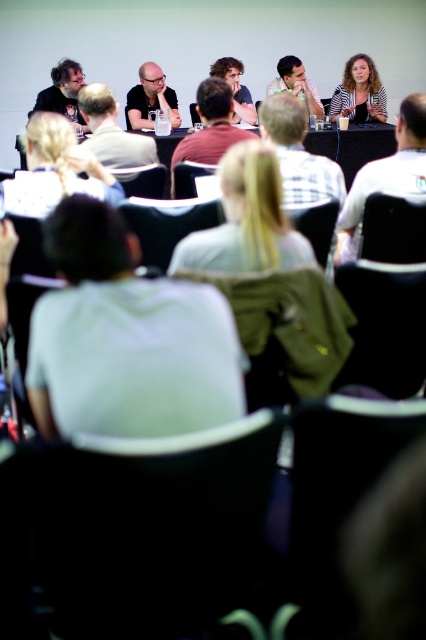
Is white checkered shirt at center taller than blonde hair at center?

No, white checkered shirt at center is not taller than blonde hair at center.

Who is positioned more to the right, white checkered shirt at center or blonde hair at center?

From the viewer's perspective, white checkered shirt at center appears more on the right side.

Which is behind, point (330, 172) or point (244, 112)?

Point (244, 112)

Find the location of a particular element. The height and width of the screenshot is (640, 426). white checkered shirt at center is located at coordinates (298, 152).

Is white cotton shirt at center wider than blonde hair at center?

Correct, the width of white cotton shirt at center exceeds that of blonde hair at center.

Who is shorter, white cotton shirt at center or blonde hair at center?

With less height is white cotton shirt at center.

Who is more distant from viewer, (91, 408) or (222, 67)?

The point (222, 67) is more distant.

Locate an element on the screen. The image size is (426, 640). white cotton shirt at center is located at coordinates (126, 339).

Based on the photo, who is shorter, light brown hair at center or white checkered shirt at center?

With less height is light brown hair at center.

Can you confirm if light brown hair at center is positioned to the right of white checkered shirt at center?

In fact, light brown hair at center is to the left of white checkered shirt at center.

Who is more forward, (264, 228) or (302, 193)?

Point (264, 228) is in front.

Locate an element on the screen. Image resolution: width=426 pixels, height=640 pixels. light brown hair at center is located at coordinates (247, 220).